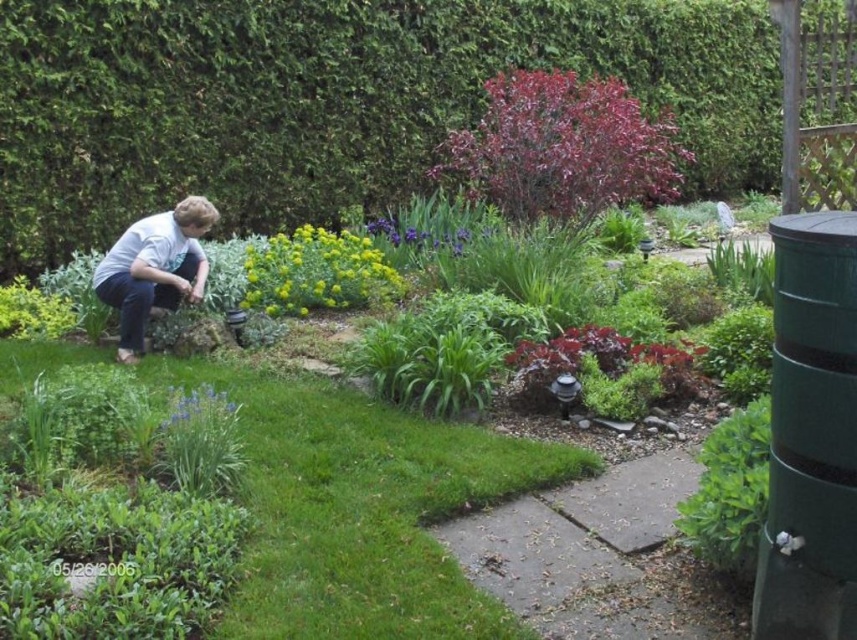
You are a gardener who wants to plant a new flower bed in the garden. You have a small flower that needs a spot with enough space. Based on the image, which area would you choose between the green grass at lower center and the purple glossy shrub at upper center?

The purple glossy shrub at upper center is larger than the green grass at lower center, so the area around the purple glossy shrub at upper center would provide more space for planting the new flower bed.

You are planning to plant a new flower bed in your garden. You have two purple plants to place there. The purple glossy shrub at upper center and the purple matte flower at center. Which one should you choose if you want a taller plant for the back of the bed?

The purple glossy shrub at upper center is much taller than the purple matte flower at center, so you should choose the purple glossy shrub at upper center for the back of the flower bed.